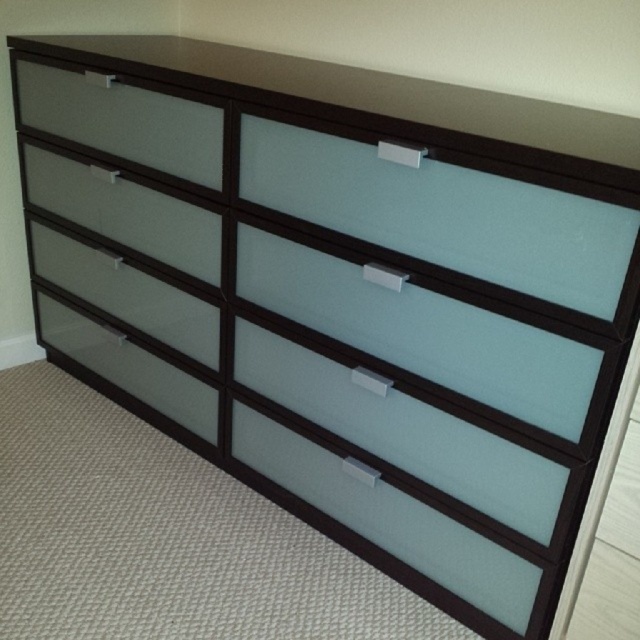
Question: Does satin glass drawer at upper left have a smaller size compared to satin glass drawer at lower left?

Choices:
 (A) no
 (B) yes

Answer: (A)

Question: Based on their relative distances, which object is nearer to the satin glass drawer at lower left?

Choices:
 (A) satin glass drawer at upper left
 (B) frosted glass drawer at lower left

Answer: (A)

Question: In this image, where is satin glass drawer at upper left located relative to satin glass drawer at lower left?

Choices:
 (A) right
 (B) left

Answer: (A)

Question: Which object is the closest to the frosted glass drawer at lower left?

Choices:
 (A) satin glass drawer at upper left
 (B) satin glass drawer at lower left
 (C) frosted glass drawer at upper left

Answer: (B)

Question: Does satin glass drawer at lower left have a smaller size compared to frosted glass drawer at lower left?

Choices:
 (A) yes
 (B) no

Answer: (B)

Question: Which object is closer to the camera taking this photo?

Choices:
 (A) satin glass drawer at upper left
 (B) frosted glass drawer at upper left
 (C) satin glass drawer at lower left

Answer: (B)